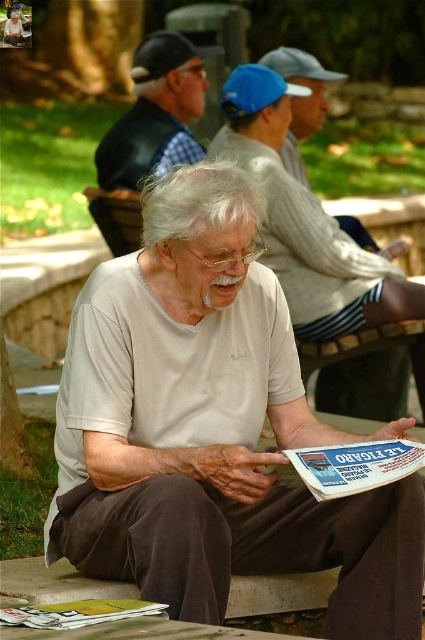
Question: Does checkered fabric vest at upper left have a greater width compared to printed paper newspaper at center?

Choices:
 (A) no
 (B) yes

Answer: (B)

Question: Which point is farther to the camera?

Choices:
 (A) yellow glossy magazine at lower left
 (B) printed paper newspaper at center
 (C) white cotton shirt at center
 (D) checkered fabric vest at upper left

Answer: (D)

Question: Which is nearer to the white cotton shirt at center?

Choices:
 (A) white matte shirt at center
 (B) printed paper newspaper at center
 (C) checkered fabric vest at upper left
 (D) yellow glossy magazine at lower left

Answer: (B)

Question: Is checkered fabric vest at upper left below yellow glossy magazine at lower left?

Choices:
 (A) yes
 (B) no

Answer: (B)

Question: Which point is closer to the camera?

Choices:
 (A) white cotton shirt at center
 (B) yellow glossy magazine at lower left
 (C) white matte shirt at center
 (D) checkered fabric vest at upper left

Answer: (B)

Question: Observing the image, what is the correct spatial positioning of white cotton shirt at center in reference to printed paper newspaper at center?

Choices:
 (A) above
 (B) below

Answer: (A)